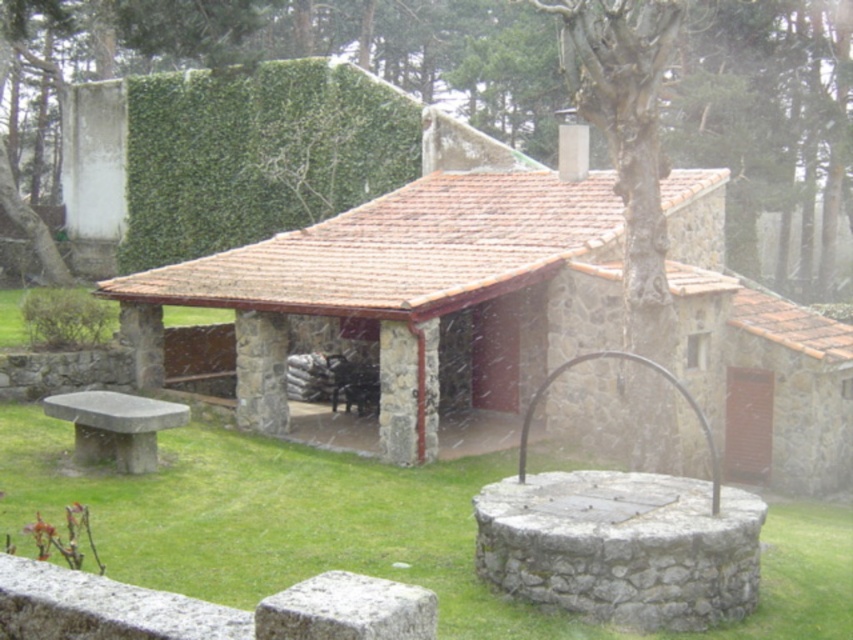
You are standing in the garden and want to walk from the stone roof hut at center to the smooth stone bench at lower left. Which direction should you face to move towards the bench?

You should face towards the lower left direction to move towards the smooth stone bench at lower left from the stone roof hut at center, as the bench is positioned to the lower left relative to the hut.

You are planning to sit on the smooth stone bench at lower left while enjoying the view of the green grass at lower center. From which direction should you face to have both the bench and the grass in your view?

Since the green grass at lower center is to the right of the smooth stone bench at lower left, you should face towards the right direction to have both the bench and the grass in your view.